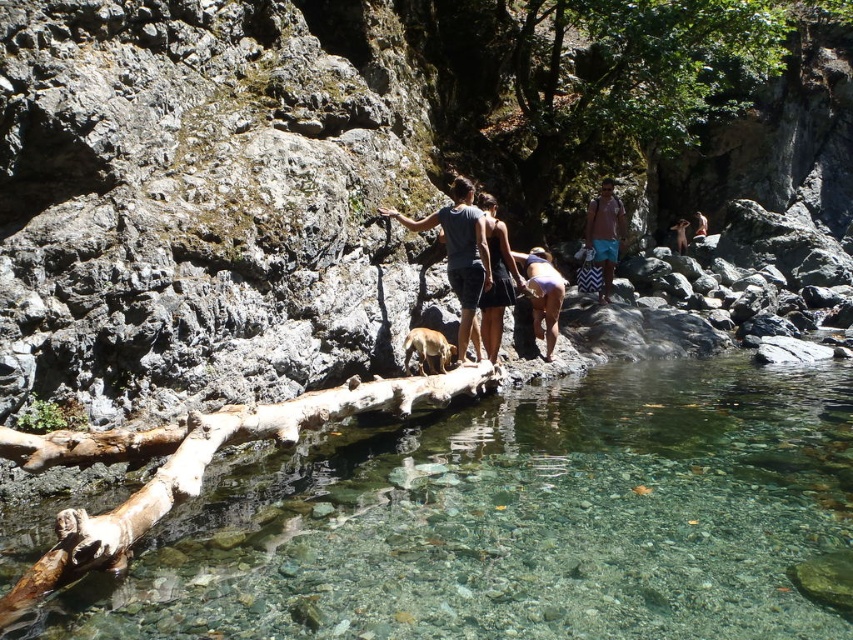
Which is behind, point (466, 189) or point (672, 227)?

Positioned behind is point (672, 227).

Is matte gray shirt at center shorter than brown leather jacket at upper right?

No, matte gray shirt at center is not shorter than brown leather jacket at upper right.

Is point (384, 212) closer to viewer compared to point (683, 230)?

That is True.

Where is `matte gray shirt at center`? This screenshot has height=640, width=853. matte gray shirt at center is located at coordinates (459, 253).

The image size is (853, 640). Describe the element at coordinates (496, 276) in the screenshot. I see `dark gray fabric dress at center` at that location.

Looking at this image, measure the distance from dark gray fabric dress at center to brown furry dog at center.

4.78 feet

At what (x,y) coordinates should I click in order to perform the action: click on dark gray fabric dress at center. Please return your answer as a coordinate pair (x, y). This screenshot has width=853, height=640. Looking at the image, I should click on (496, 276).

How much distance is there between matte gray shirt at center and brown furry dog at center?

A distance of 37.41 inches exists between matte gray shirt at center and brown furry dog at center.

In order to click on matte gray shirt at center in this screenshot , I will do `click(459, 253)`.